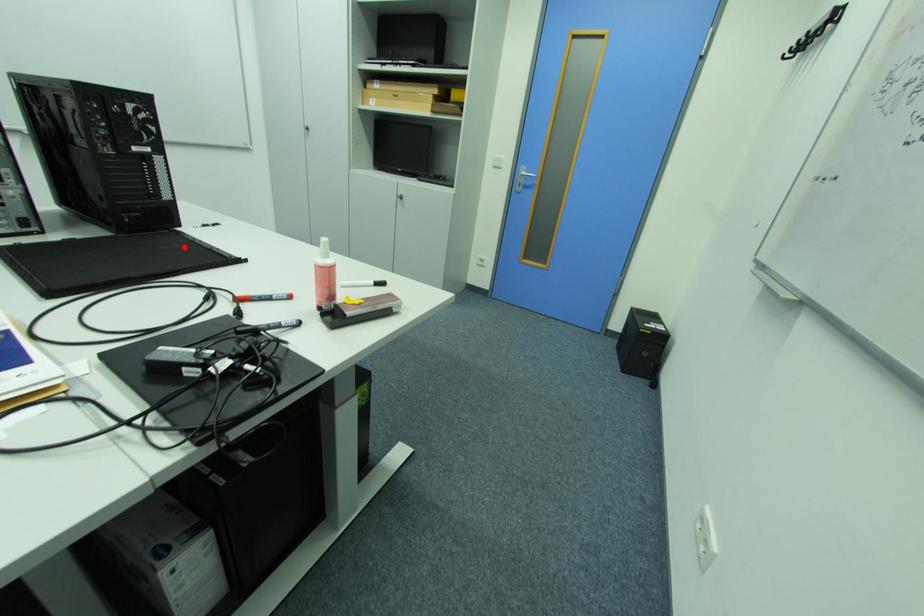
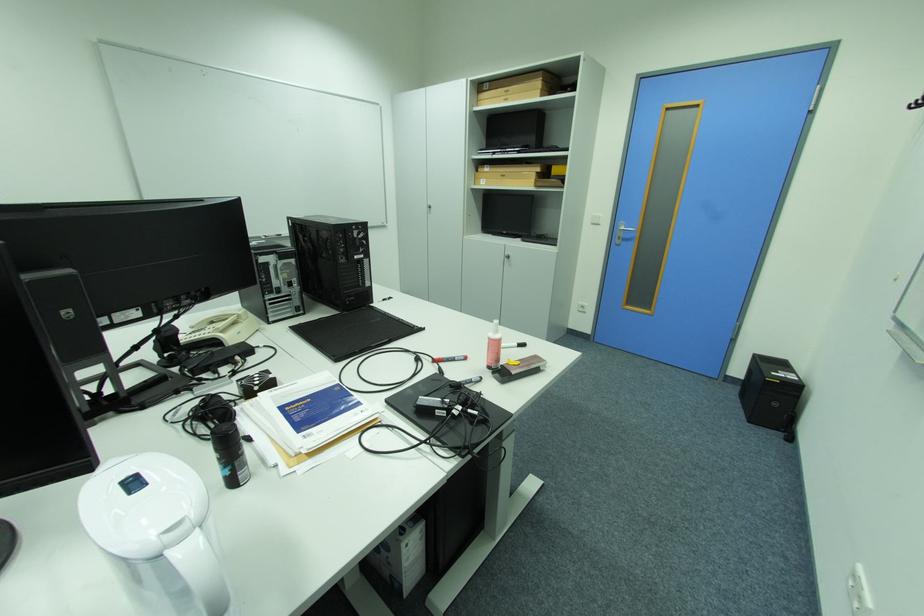
In the second image, find the point that corresponds to the highlighted location in the first image.

(386, 320)